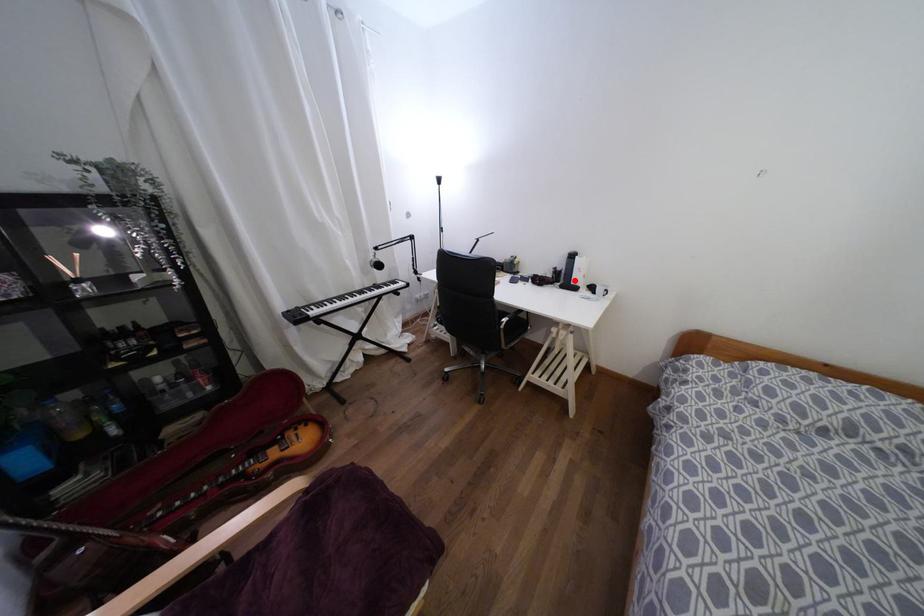
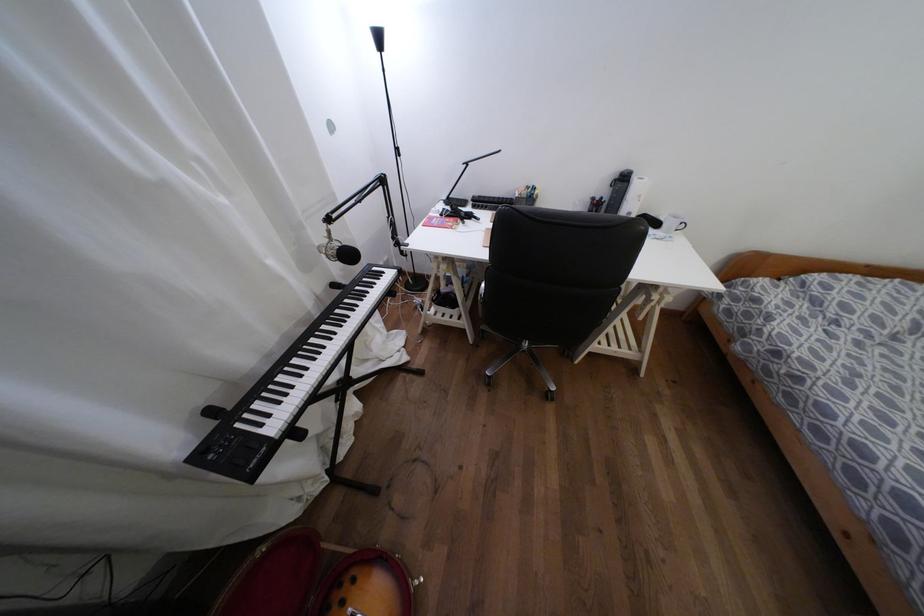
Where in the second image is the point corresponding to the highlighted location from the first image?

(628, 213)